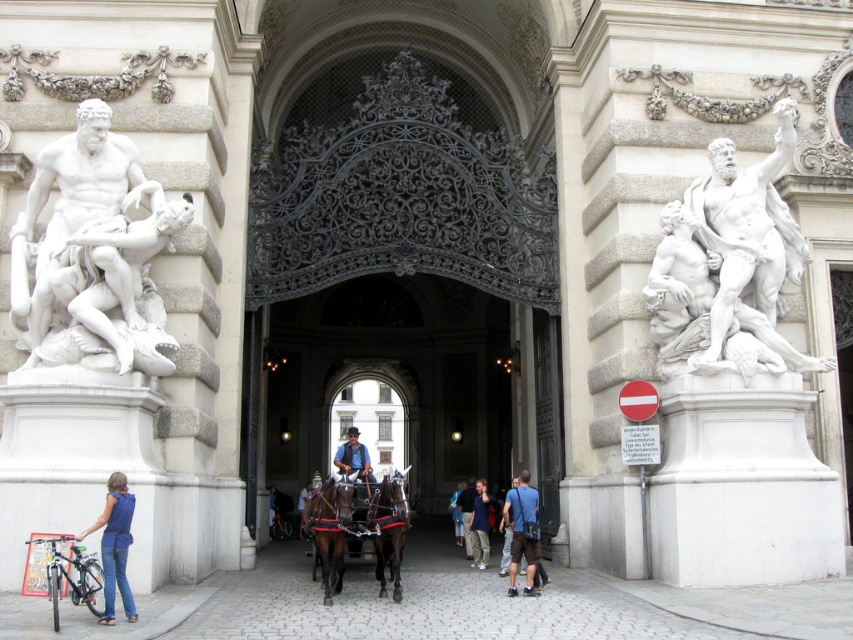
Question: Estimate the real-world distances between objects in this image. Which object is closer to the blue denim jeans at lower left?

Choices:
 (A) blue fabric bag at center
 (B) blue denim jeans at center
 (C) white marble statue at right
 (D) shiny dark brown horse at center

Answer: (A)

Question: Is white marble statue at right wider than blue denim jeans at lower left?

Choices:
 (A) no
 (B) yes

Answer: (B)

Question: Which object appears farthest from the camera in this image?

Choices:
 (A) brown glossy horse at center
 (B) blue fabric bag at center
 (C) blue denim jeans at center

Answer: (C)

Question: Which of the following is the farthest from the observer?

Choices:
 (A) white marble statue at left
 (B) blue fabric bag at center
 (C) shiny dark brown horse at center

Answer: (B)

Question: Does white marble statue at left have a greater width compared to blue denim jeans at lower left?

Choices:
 (A) yes
 (B) no

Answer: (A)

Question: Observing the image, what is the correct spatial positioning of white marble statue at left in reference to blue fabric bag at center?

Choices:
 (A) left
 (B) right

Answer: (A)